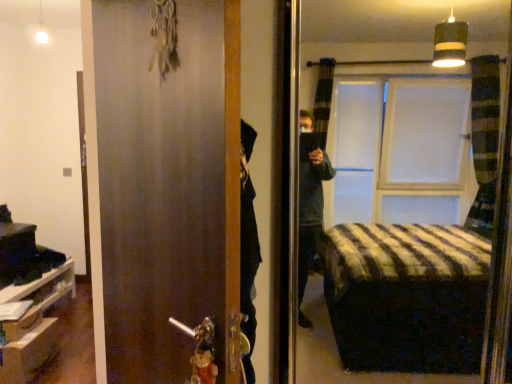
Question: Is white matte cabinet at lower left thinner than matte brown door at center?

Choices:
 (A) yes
 (B) no

Answer: (B)

Question: Is white matte cabinet at lower left to the left of matte brown door at center from the viewer's perspective?

Choices:
 (A) no
 (B) yes

Answer: (B)

Question: Is matte brown door at center at the back of white matte cabinet at lower left?

Choices:
 (A) yes
 (B) no

Answer: (B)

Question: Does white matte cabinet at lower left have a smaller size compared to matte brown door at center?

Choices:
 (A) yes
 (B) no

Answer: (A)

Question: Is matte brown door at center a part of white matte cabinet at lower left?

Choices:
 (A) no
 (B) yes

Answer: (A)

Question: Is point (73, 289) closer or farther from the camera than point (23, 367)?

Choices:
 (A) farther
 (B) closer

Answer: (A)

Question: Is white matte cabinet at lower left wider or thinner than wooden drawer at lower left?

Choices:
 (A) wide
 (B) thin

Answer: (A)

Question: From their relative heights in the image, would you say white matte cabinet at lower left is taller or shorter than wooden drawer at lower left?

Choices:
 (A) short
 (B) tall

Answer: (B)

Question: Is white matte cabinet at lower left in front of or behind wooden drawer at lower left in the image?

Choices:
 (A) behind
 (B) front

Answer: (A)

Question: Looking at their shapes, would you say white matte cabinet at lower left is wider or thinner than matte brown door at center?

Choices:
 (A) thin
 (B) wide

Answer: (B)

Question: Is point (31, 345) closer or farther from the camera than point (108, 218)?

Choices:
 (A) farther
 (B) closer

Answer: (A)

Question: Is white matte cabinet at lower left bigger or smaller than matte brown door at center?

Choices:
 (A) big
 (B) small

Answer: (B)

Question: Would you say white matte cabinet at lower left is to the left or to the right of matte brown door at center in the picture?

Choices:
 (A) right
 (B) left

Answer: (B)

Question: From a real-world perspective, is matte brown door at center above or below white matte cabinet at lower left?

Choices:
 (A) above
 (B) below

Answer: (A)

Question: Considering the positions of matte brown door at center and white matte cabinet at lower left in the image, is matte brown door at center wider or thinner than white matte cabinet at lower left?

Choices:
 (A) thin
 (B) wide

Answer: (A)